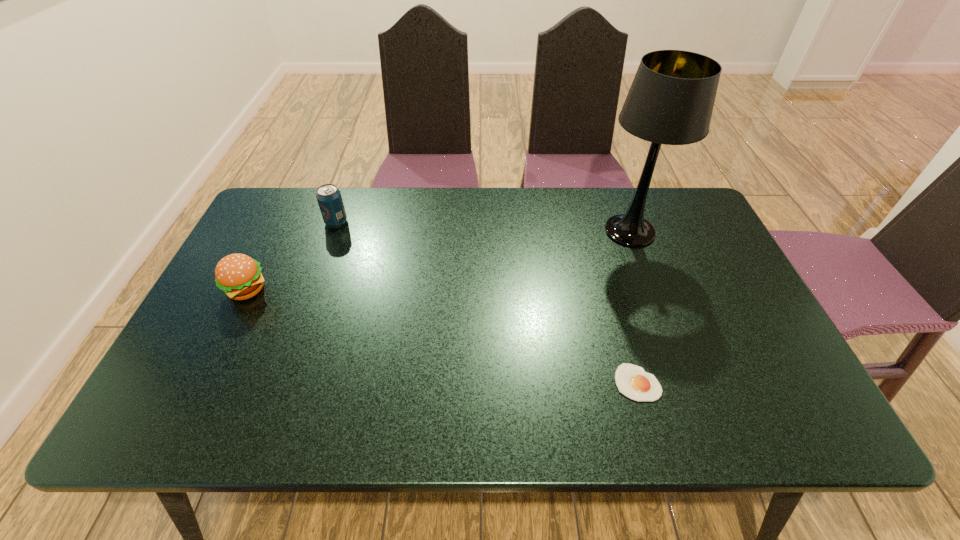
The height and width of the screenshot is (540, 960). Identify the location of the closest object to the third farthest object. (329, 198).

Where is `object that is the third closest to the hamburger`? The height and width of the screenshot is (540, 960). object that is the third closest to the hamburger is located at coordinates (671, 99).

Identify the location of vacant point that satisfies the following two spatial constraints: 1. on the front side of the second object from left to right; 2. on the left side of the nearest object. (279, 382).

Identify the location of vacant space that satisfies the following two spatial constraints: 1. on the back side of the table lamp; 2. on the right side of the leftmost object. Image resolution: width=960 pixels, height=540 pixels. (276, 231).